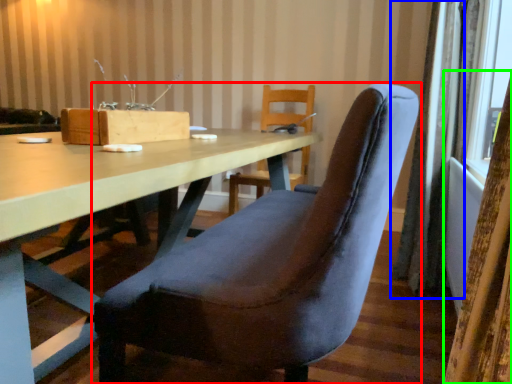
Question: Which object is positioned farthest from chair (highlighted by a red box)? Select from curtain (highlighted by a blue box) and curtain (highlighted by a green box).

Choices:
 (A) curtain
 (B) curtain

Answer: (A)